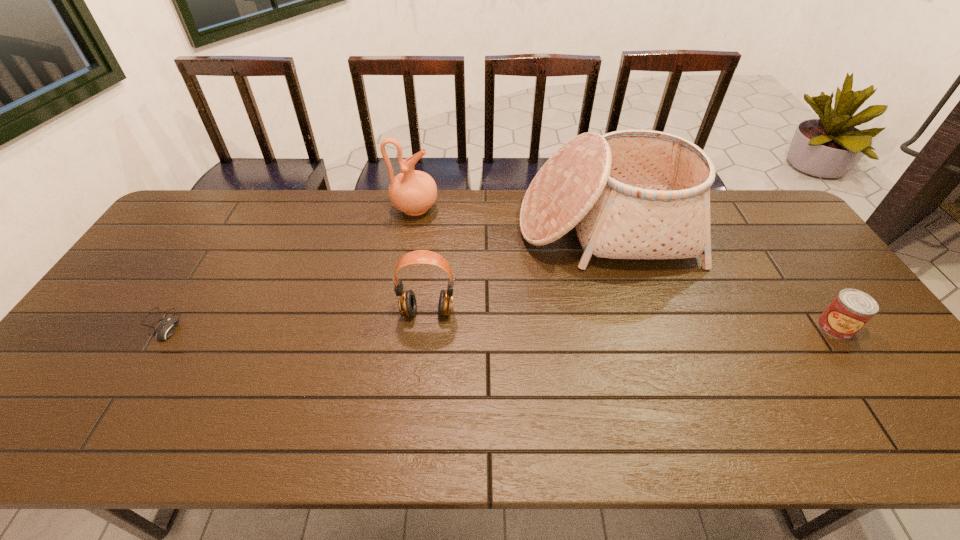
Identify the location of free space between the headset and the second object from right to left. This screenshot has width=960, height=540. (516, 270).

Where is `object that is the closest to the headset`? This screenshot has width=960, height=540. object that is the closest to the headset is located at coordinates (631, 194).

Choose which object is the second nearest neighbor to the fourth tallest object. Please provide its 2D coordinates. Your answer should be formatted as a tuple, i.e. [(x, y)], where the tuple contains the x and y coordinates of a point satisfying the conditions above.

[(407, 304)]

Find the location of a particular element. free space that satisfies the following two spatial constraints: 1. on the front side of the rightmost object; 2. on the right side of the leftmost object is located at coordinates (157, 327).

Find the location of a particular element. Image resolution: width=960 pixels, height=540 pixels. vacant point that satisfies the following two spatial constraints: 1. on the ear cups of the can; 2. on the right side of the headset is located at coordinates (426, 327).

The height and width of the screenshot is (540, 960). I want to click on vacant space that satisfies the following two spatial constraints: 1. on the front side of the leftmost object; 2. on the left side of the rightmost object, so click(157, 327).